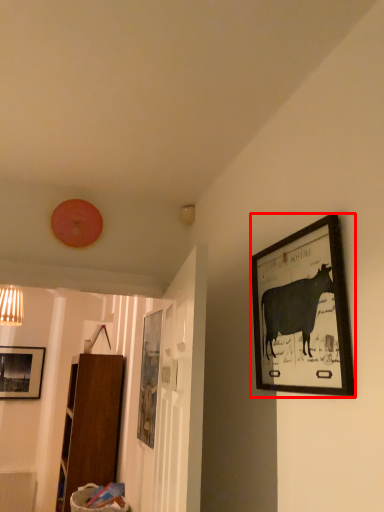
Question: From the image, what is the correct spatial relationship of picture frame (annotated by the red box) in relation to picture frame?

Choices:
 (A) right
 (B) left

Answer: (A)